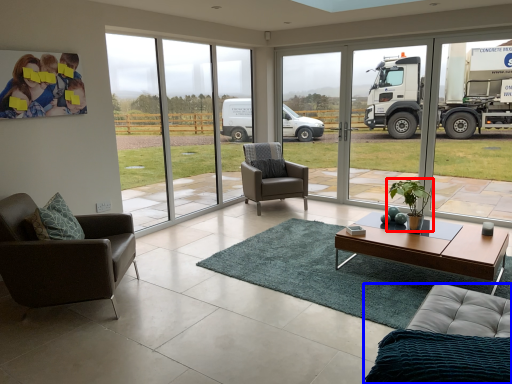
Question: Which object appears closest to the camera in this image, houseplant (highlighted by a red box) or studio couch (highlighted by a blue box)?

Choices:
 (A) houseplant
 (B) studio couch

Answer: (B)